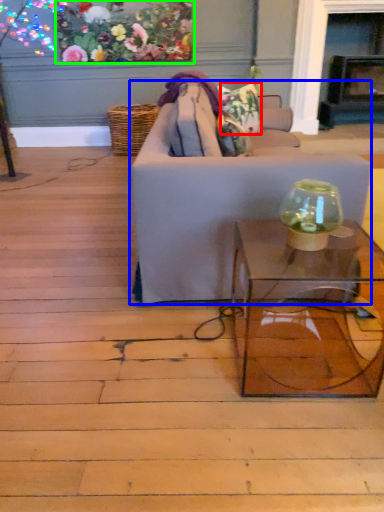
Question: Which object is the farthest from flower (highlighted by a red box)? Choose among these: studio couch (highlighted by a blue box) or floral arrangement (highlighted by a green box).

Choices:
 (A) studio couch
 (B) floral arrangement

Answer: (B)